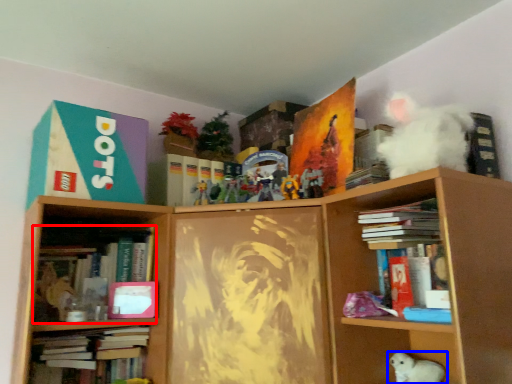
Question: Which of the following is the closest to the observer, book (highlighted by a red box) or toy (highlighted by a blue box)?

Choices:
 (A) book
 (B) toy

Answer: (B)